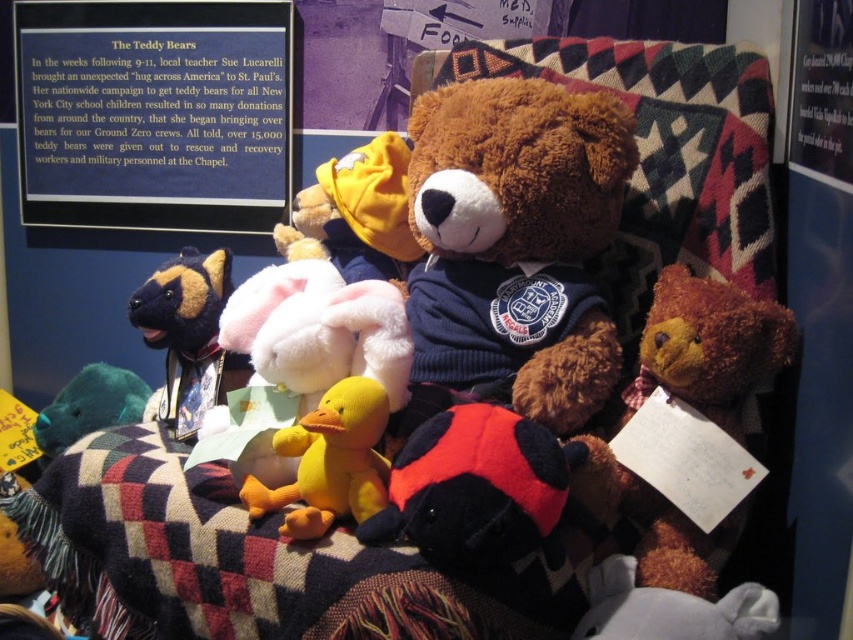
Question: Which point appears closest to the camera in this image?

Choices:
 (A) (196, 358)
 (B) (366, 387)
 (C) (96, 540)
 (D) (523, 193)

Answer: (B)

Question: Can you confirm if fuzzy brown teddy bear at center is smaller than velvety teal teddy bear at lower left?

Choices:
 (A) no
 (B) yes

Answer: (B)

Question: Which point appears farthest from the camera in this image?

Choices:
 (A) (94, 365)
 (B) (196, 8)

Answer: (B)

Question: Which of these objects is positioned farthest from the soft brown teddy bear at center?

Choices:
 (A) fuzzy brown teddy bear at center
 (B) checkerboard wool blanket at center
 (C) blue/metallic signboard at upper left

Answer: (C)

Question: Is soft brown teddy bear at center to the right of velvety teal teddy bear at lower left from the viewer's perspective?

Choices:
 (A) no
 (B) yes

Answer: (B)

Question: Is soft brown teddy bear at center wider than fuzzy brown teddy bear at center?

Choices:
 (A) no
 (B) yes

Answer: (B)